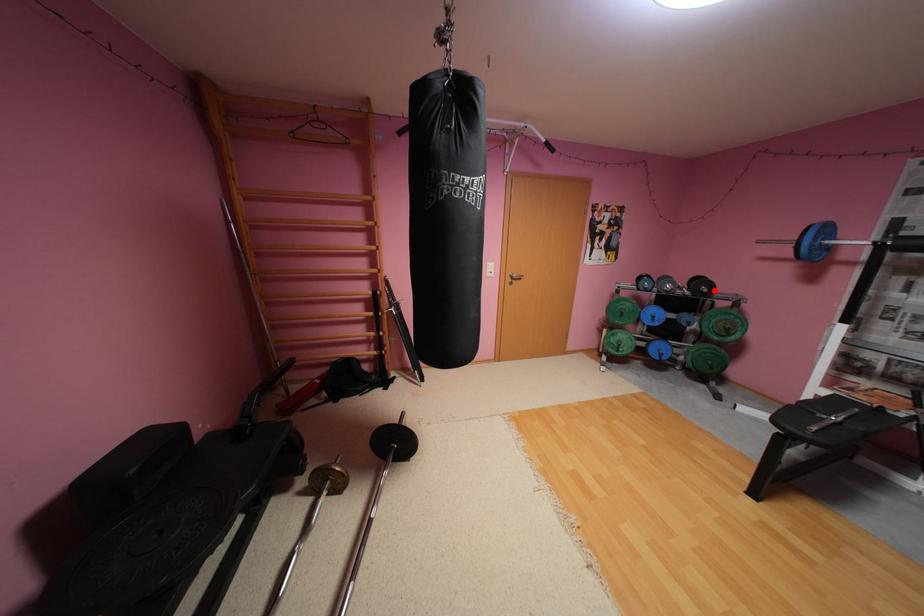
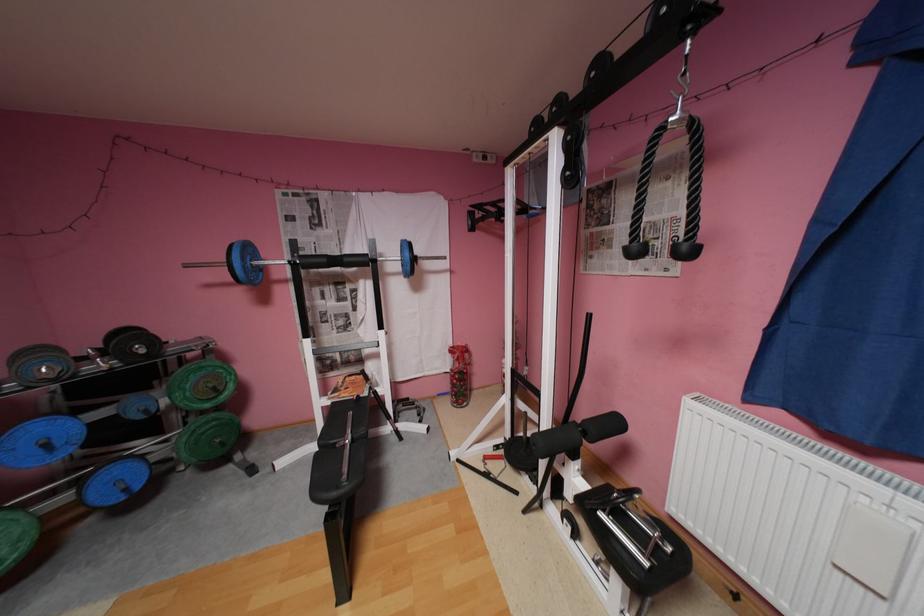
Question: I am providing you with two images of the same scene from different viewpoints. A red point is marked on the first image. At the location where the point appears in image 1, is it still visible in image 2?

Choices:
 (A) Yes
 (B) No

Answer: (A)